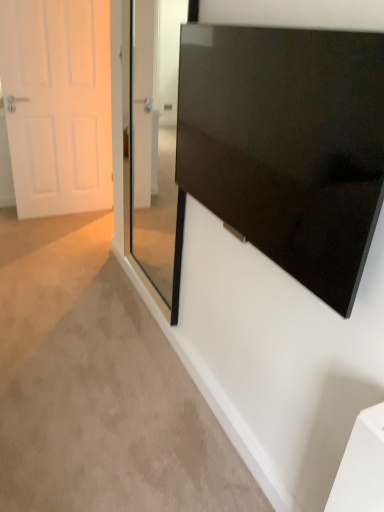
Question: Can you confirm if transparent glass door at center is wider than glossy black screen at upper right?

Choices:
 (A) yes
 (B) no

Answer: (B)

Question: Does transparent glass door at center have a greater height compared to glossy black screen at upper right?

Choices:
 (A) no
 (B) yes

Answer: (B)

Question: Could you tell me if transparent glass door at center is facing glossy black screen at upper right?

Choices:
 (A) no
 (B) yes

Answer: (A)

Question: From the image's perspective, would you say transparent glass door at center is positioned over glossy black screen at upper right?

Choices:
 (A) yes
 (B) no

Answer: (A)

Question: From a real-world perspective, is transparent glass door at center under glossy black screen at upper right?

Choices:
 (A) no
 (B) yes

Answer: (B)

Question: Does transparent glass door at center lie in front of glossy black screen at upper right?

Choices:
 (A) yes
 (B) no

Answer: (B)

Question: Can we say glossy black screen at upper right lies outside white matte door at left?

Choices:
 (A) yes
 (B) no

Answer: (A)

Question: Is glossy black screen at upper right shorter than white matte door at left?

Choices:
 (A) yes
 (B) no

Answer: (A)

Question: Can you confirm if glossy black screen at upper right is positioned to the right of white matte door at left?

Choices:
 (A) yes
 (B) no

Answer: (A)

Question: From the image's perspective, does glossy black screen at upper right appear lower than white matte door at left?

Choices:
 (A) no
 (B) yes

Answer: (B)

Question: Is glossy black screen at upper right beside white matte door at left?

Choices:
 (A) no
 (B) yes

Answer: (A)

Question: Can you confirm if glossy black screen at upper right is positioned to the left of white matte door at left?

Choices:
 (A) no
 (B) yes

Answer: (A)

Question: Does transparent glass door at center have a smaller size compared to white matte door at left?

Choices:
 (A) yes
 (B) no

Answer: (A)